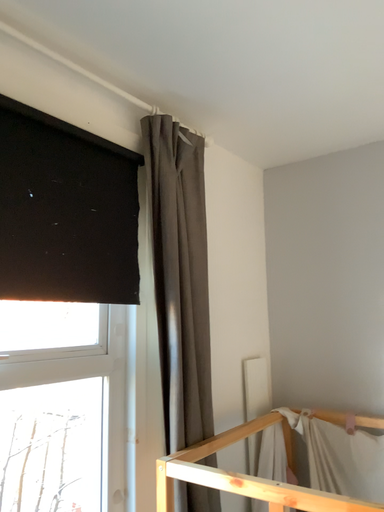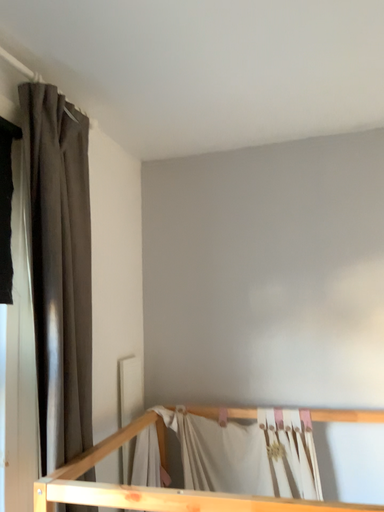
Question: Which way did the camera rotate in the video?

Choices:
 (A) rotated left
 (B) rotated right

Answer: (B)